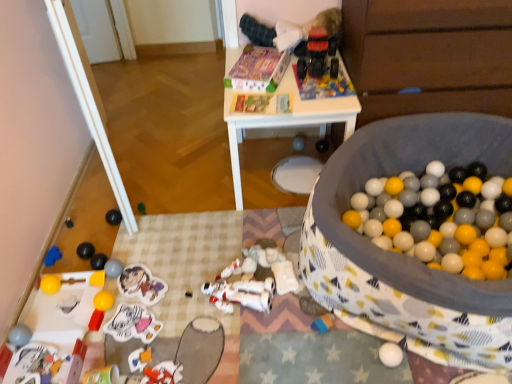
Locate an element on the screen. This screenshot has width=512, height=384. vacant area that is situated to the right of yellow rubber ball at lower left, positioned as the 9th toy in left-to-right order is located at coordinates (149, 306).